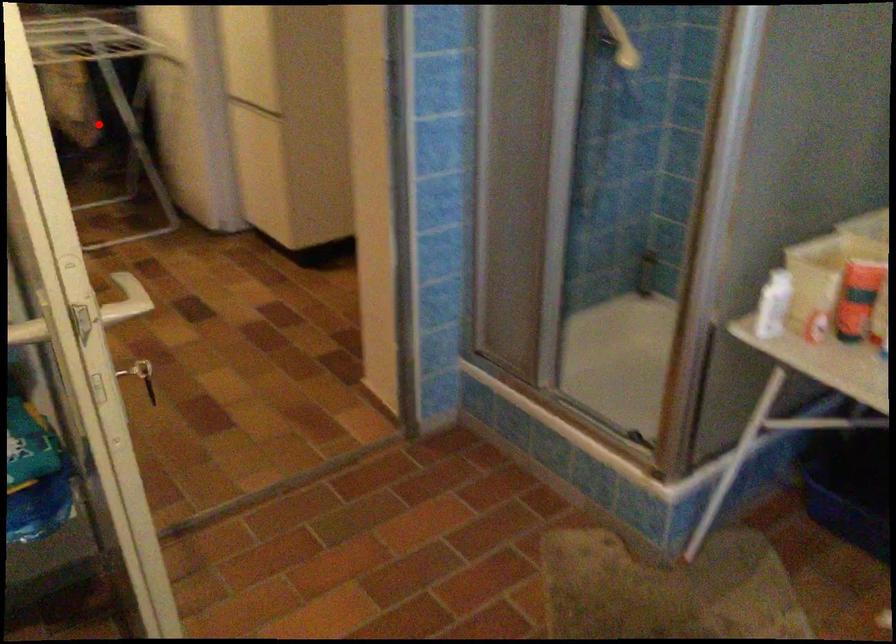
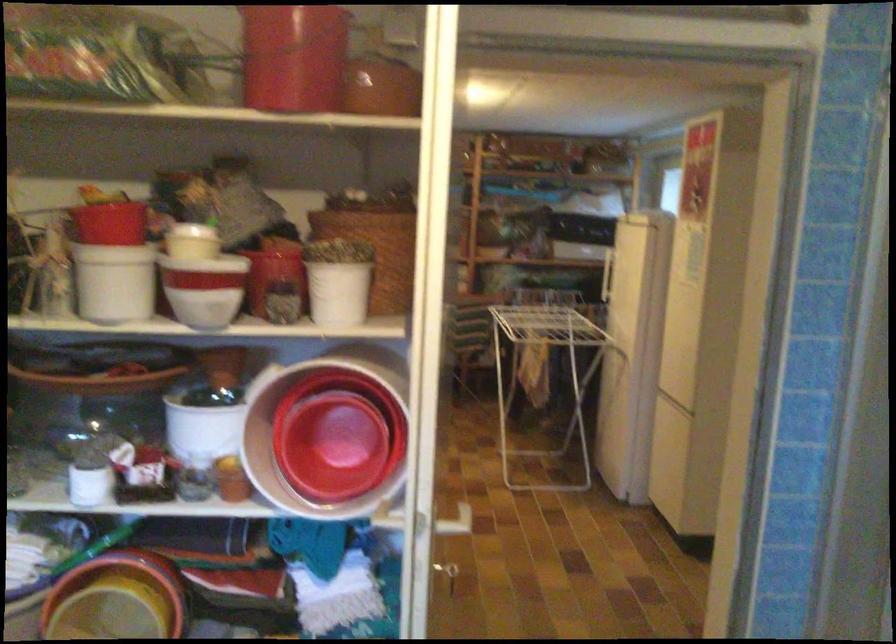
Where in the second image is the point corresponding to the highlighted location from the first image?

(545, 375)